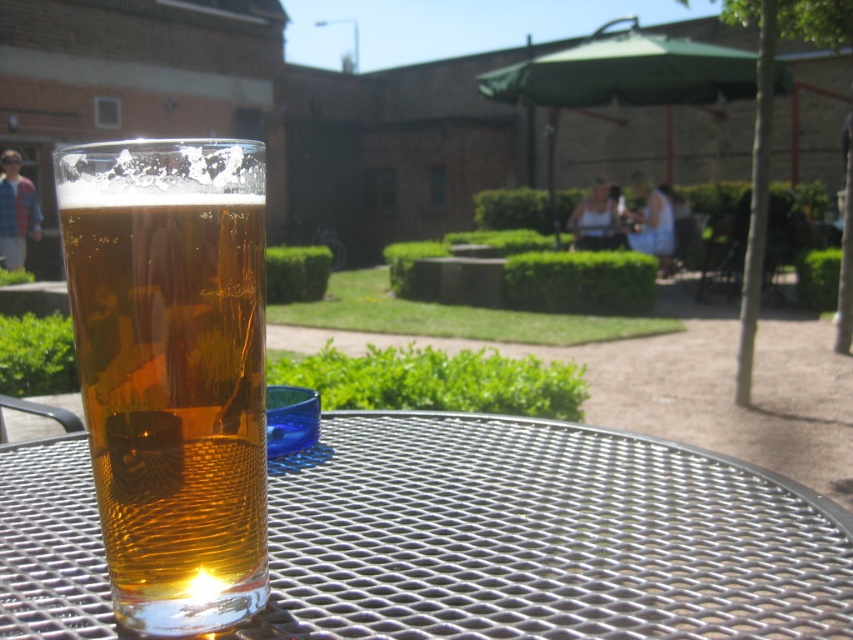
You are setting up a small party on the metallic silver table at center. You have a translucent amber glass at center that you want to place on the table. Considering the table and glass dimensions, will the glass fit on the table without overhanging the edges?

The metallic silver table at center is wider than the translucent amber glass at center, so the glass will fit without overhanging the edges.

You are standing at the edge of the patio and want to place a metallic silver table at center where the point is located. Is the point at (541, 536) the correct location for the table?

Yes, the point at (541, 536) corresponds to the metallic silver table at center, so it is the correct location for the table.

You are a server at a cafe and need to place a new menu on the table. The menu is 12 inches tall. Can you fit the menu vertically on the metallic silver table at center without it hanging off the edge, considering the height of the translucent amber glass at center?

The metallic silver table at center is not as tall as the translucent amber glass at center. Since the menu is 12 inches tall, and the table is shorter than the glass, the menu might not fit vertically if the table height is less than 12 inches. However, the description does not provide exact measurements, so we cannot confirm for sure.